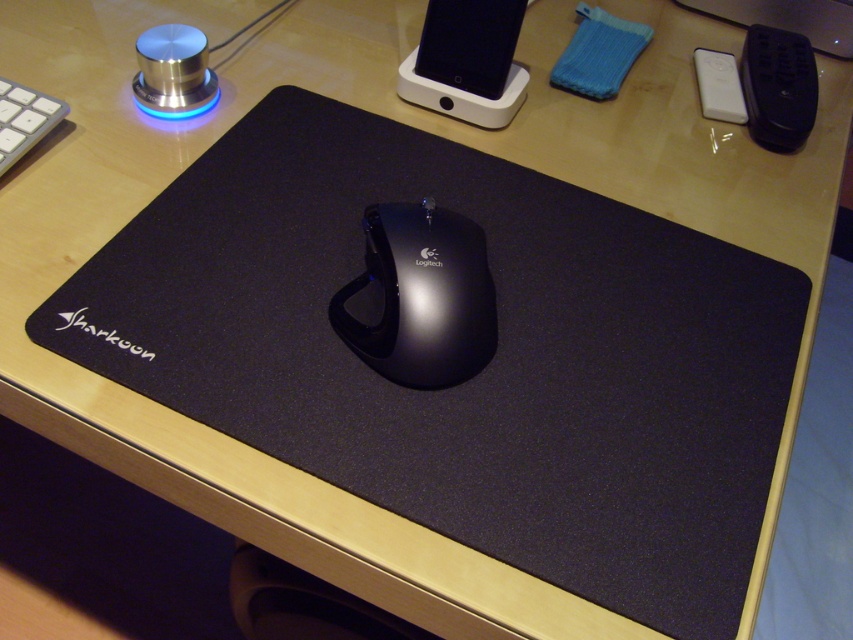
Question: Can you confirm if black glossy mouse at center is wider than white plastic keyboard at upper left?

Choices:
 (A) yes
 (B) no

Answer: (A)

Question: Which point is closer to the camera?

Choices:
 (A) black glossy mouse at center
 (B) white plastic keyboard at upper left

Answer: (A)

Question: Does black glossy mouse at center appear under white plastic keyboard at upper left?

Choices:
 (A) no
 (B) yes

Answer: (B)

Question: Does black glossy mouse at center come in front of white plastic keyboard at upper left?

Choices:
 (A) no
 (B) yes

Answer: (B)

Question: Among these points, which one is nearest to the camera?

Choices:
 (A) (7, 115)
 (B) (460, 323)

Answer: (B)